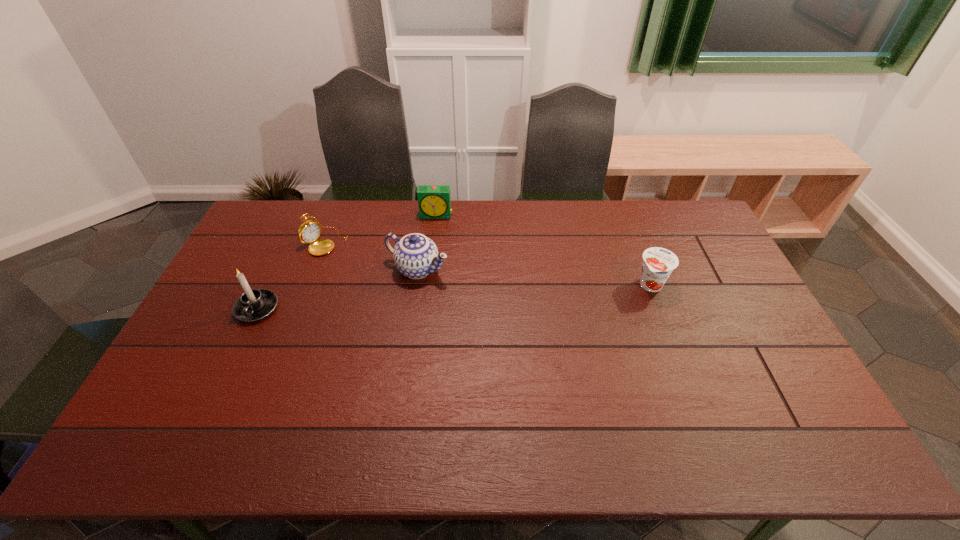
Where is `candle holder`? The width and height of the screenshot is (960, 540). candle holder is located at coordinates (254, 304).

The image size is (960, 540). Find the location of `yogurt`. yogurt is located at coordinates (658, 264).

Identify the location of chinaware. This screenshot has height=540, width=960. (415, 256).

Locate an element on the screen. This screenshot has height=540, width=960. alarm clock is located at coordinates (434, 201).

Identify the location of pocket watch. (308, 233).

Identify the location of vacant space located 0.170m with a handle on the side of the tallest object. (226, 375).

This screenshot has width=960, height=540. In order to click on vacant area situated 0.050m on the back of the rightmost object in this screenshot , I will do `click(642, 262)`.

This screenshot has width=960, height=540. What are the coordinates of `free spot located 0.120m at the spout of the chinaware` in the screenshot? It's located at (477, 290).

Find the location of a particular element. The height and width of the screenshot is (540, 960). vacant area situated 0.050m at the spout of the chinaware is located at coordinates (459, 282).

Locate an element on the screen. vacant space located at the spout of the chinaware is located at coordinates (467, 285).